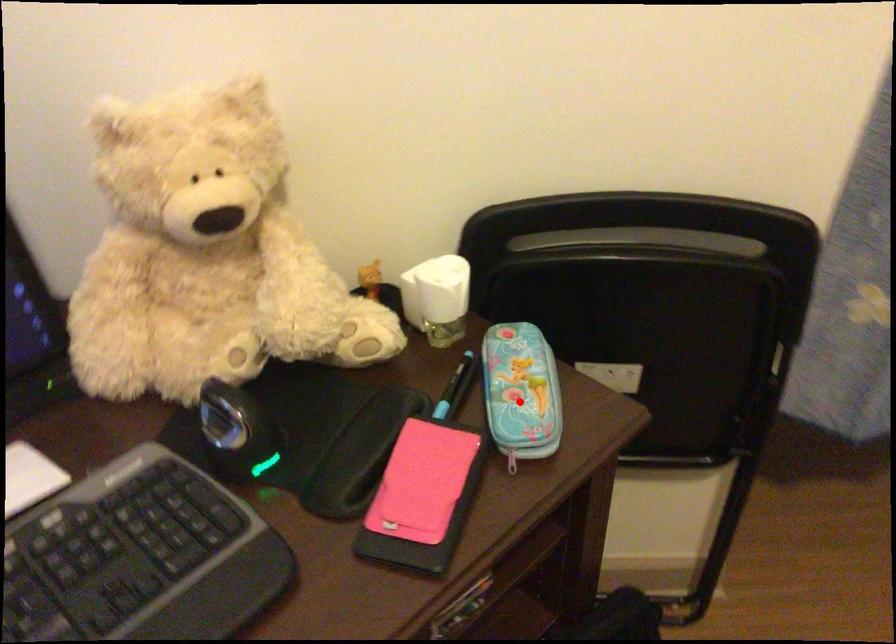
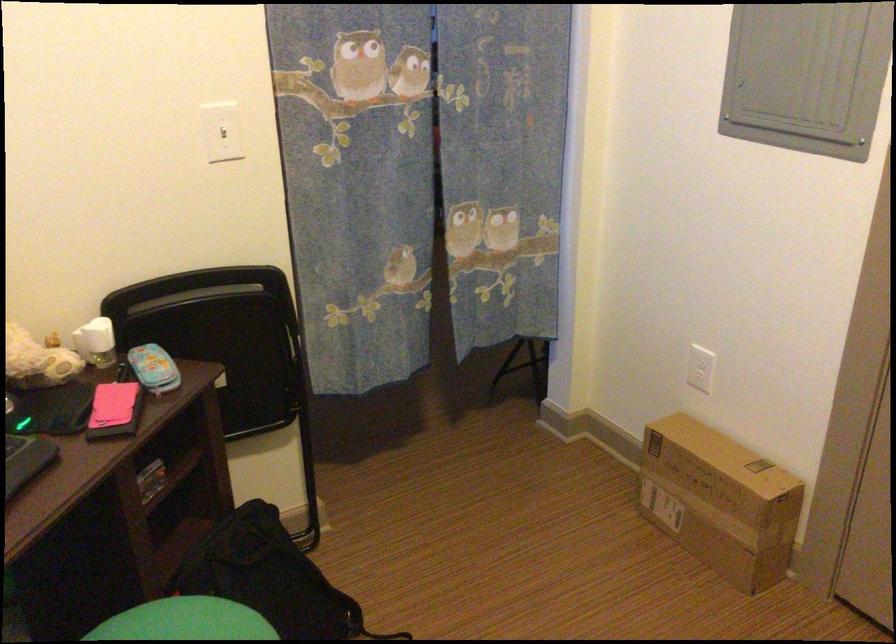
Question: A red point is marked in image1. In image2, is the corresponding 3D point closer to the camera or farther? Reply with the corresponding letter.

Choices:
 (A) The corresponding 3D point is closer.
 (B) The corresponding 3D point is farther.

Answer: (B)